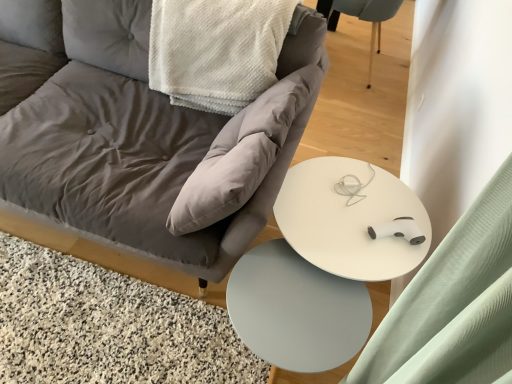
At what (x,y) coordinates should I click in order to perform the action: click on vacant area on top of white matte table at center (from a real-world perspective). Please return your answer as a coordinate pair (x, y). This screenshot has height=384, width=512. Looking at the image, I should click on (309, 315).